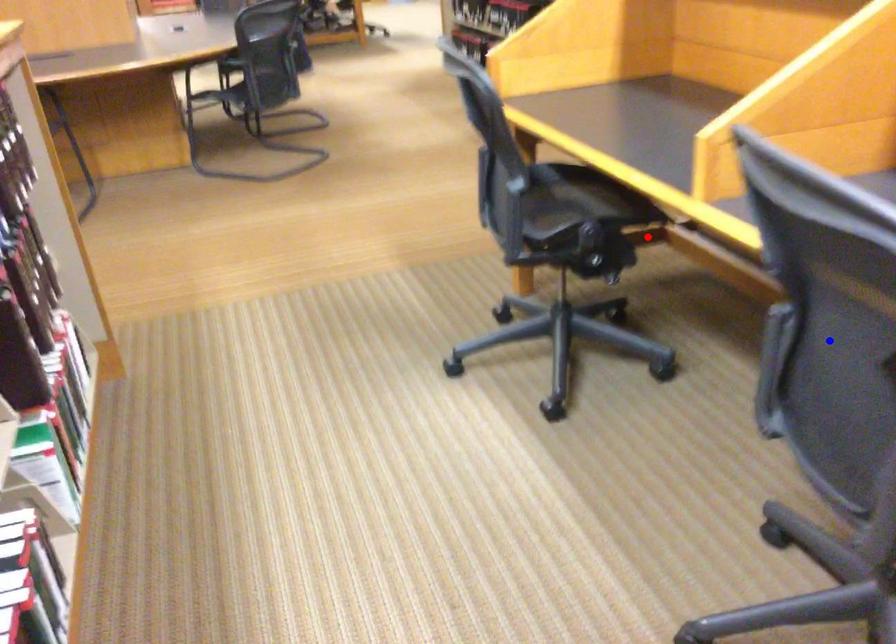
Question: Two points are marked on the image. Which point is closer to the camera?

Choices:
 (A) Blue point is closer.
 (B) Red point is closer.

Answer: (A)